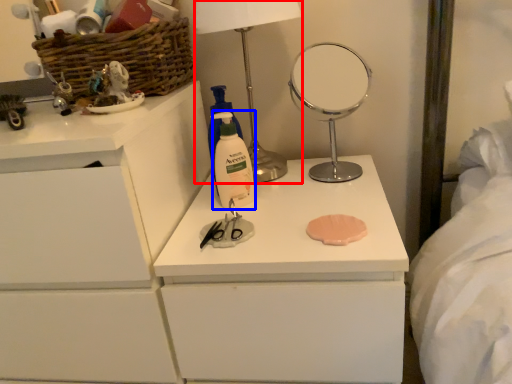
Question: Which object is further to the camera taking this photo, table lamp (highlighted by a red box) or cleaning product (highlighted by a blue box)?

Choices:
 (A) table lamp
 (B) cleaning product

Answer: (B)